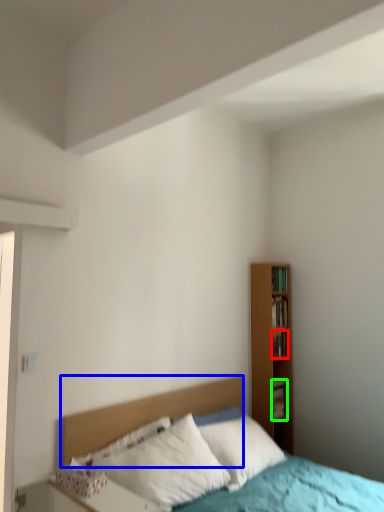
Question: Which object is positioned closest to book (highlighted by a red box)? Select from headboard (highlighted by a blue box) and book (highlighted by a green box).

Choices:
 (A) headboard
 (B) book

Answer: (B)